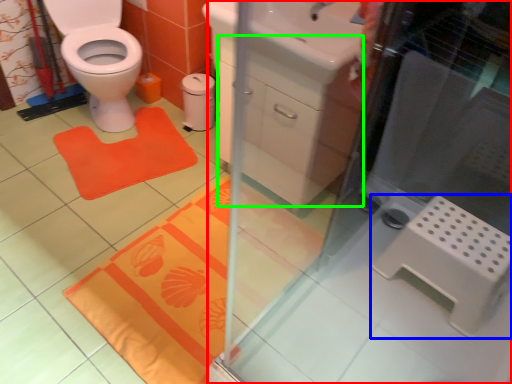
Question: Based on their relative distances, which object is nearer to screen door (highlighted by a red box)? Choose from step stool (highlighted by a blue box) and drawer (highlighted by a green box).

Choices:
 (A) step stool
 (B) drawer

Answer: (A)